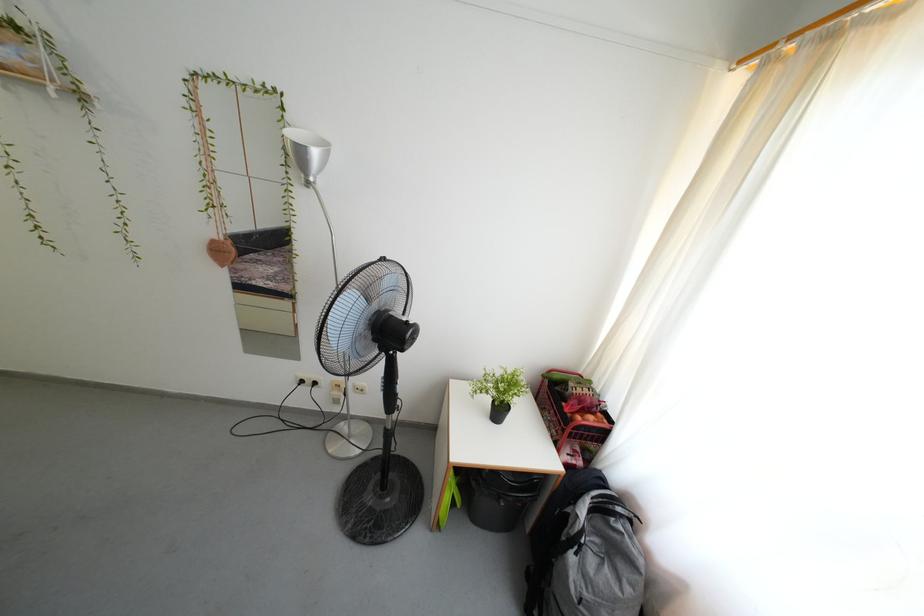
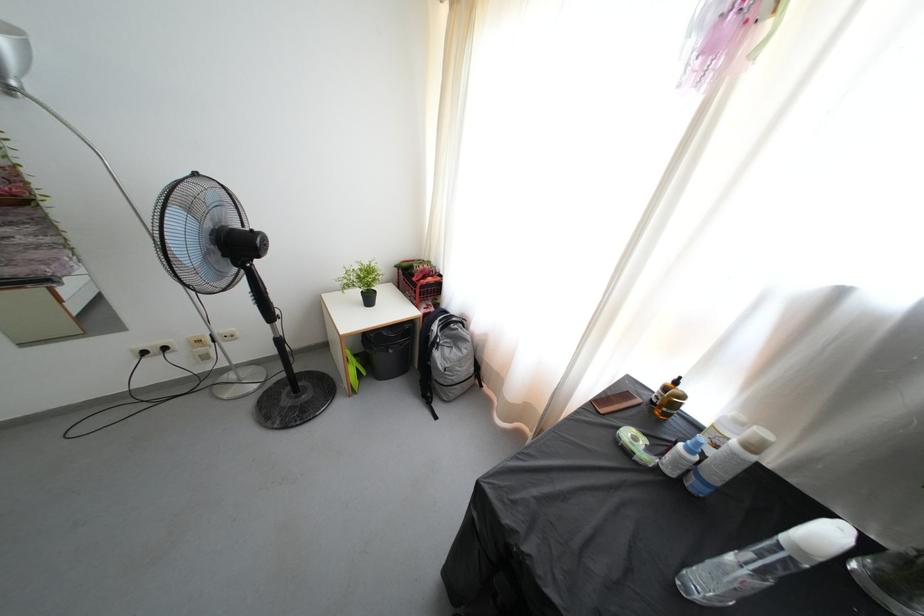
Find the pixel in the second image that matches (594,387) in the first image.

(434, 268)